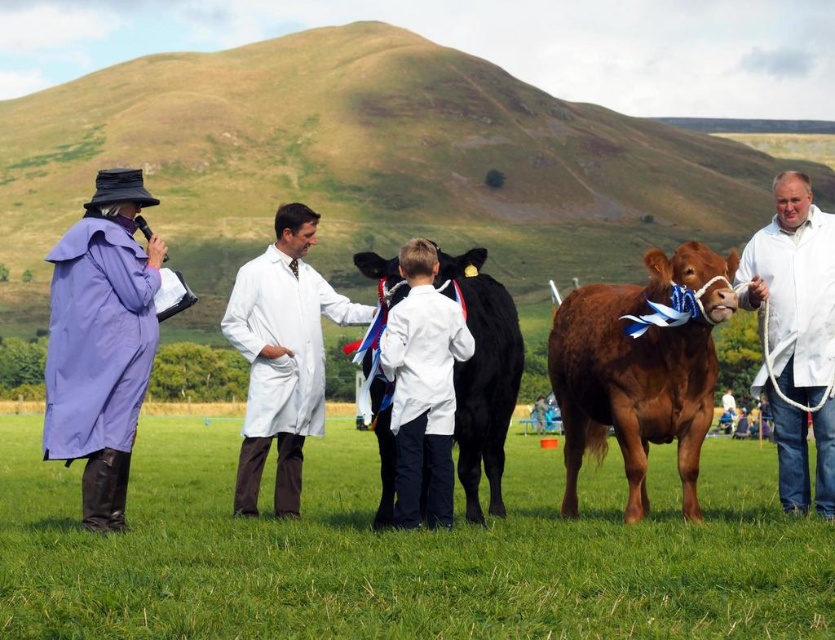
You are a photographer at the livestock show and want to capture a photo where the white lab coat at center and the black glossy cow at center are both visible. Based on their heights, which object should you focus on to ensure both are in frame without cropping?

The white lab coat at center is taller than the black glossy cow at center, so focusing on the white lab coat at center will help ensure both are in frame without cropping.

You are a photographer at the event and want to capture both the purple fabric coat at left and the black glossy cow at center in a single frame. Since you want to highlight both subjects equally, which subject should you move closer to your camera to achieve this?

The purple fabric coat at left is larger in size than the black glossy cow at center. To balance their sizes in the photo, you should move closer to the black glossy cow at center so it appears larger in the frame, matching the size of the purple fabric coat at left.